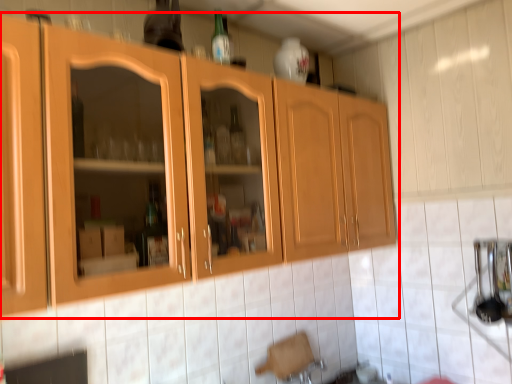
Question: In this image, where is cabinetry (annotated by the red box) located relative to bottle?

Choices:
 (A) right
 (B) left

Answer: (A)